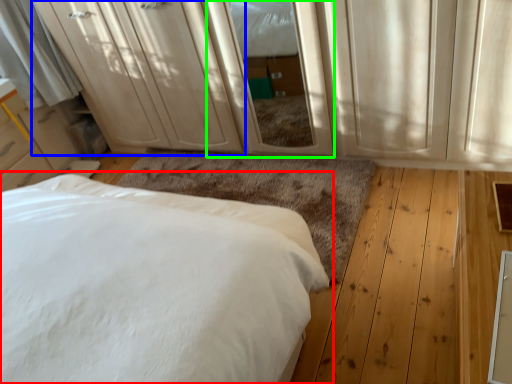
Question: Which object is the farthest from bed (highlighted by a red box)? Choose among these: dresser (highlighted by a blue box) or screen door (highlighted by a green box).

Choices:
 (A) dresser
 (B) screen door

Answer: (A)